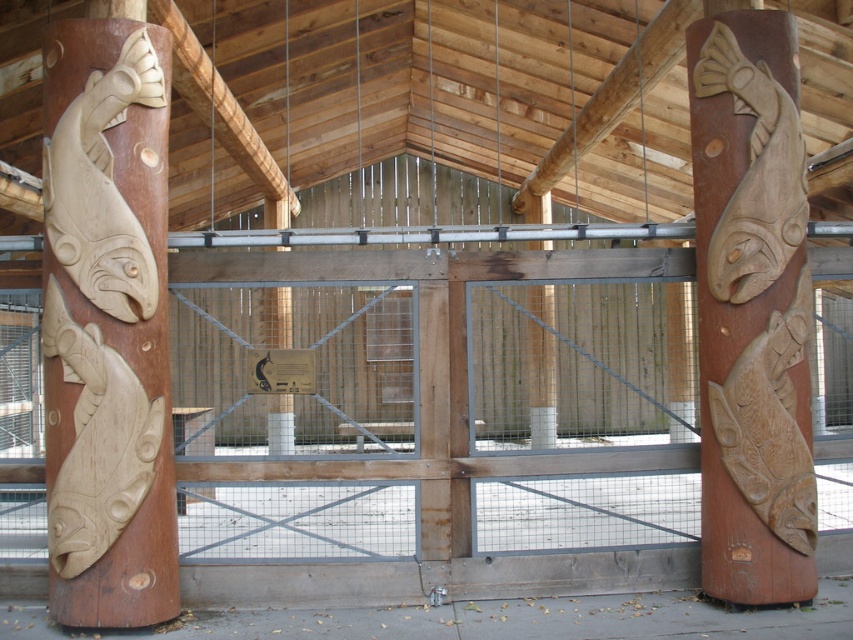
Question: Among these points, which one is nearest to the camera?

Choices:
 (A) (73, 189)
 (B) (801, 156)

Answer: (A)

Question: Which point is farther from the camera taking this photo?

Choices:
 (A) (167, 401)
 (B) (712, 296)

Answer: (B)

Question: Can you confirm if natural wood fish at left is positioned above wooden carved fish at right?

Choices:
 (A) yes
 (B) no

Answer: (B)

Question: Is natural wood fish at left smaller than wooden carved fish at right?

Choices:
 (A) yes
 (B) no

Answer: (A)

Question: Where is natural wood fish at left located in relation to wooden carved fish at right in the image?

Choices:
 (A) left
 (B) right

Answer: (A)

Question: Which object is closer to the camera taking this photo?

Choices:
 (A) wooden carved fish at right
 (B) natural wood fish at left

Answer: (B)